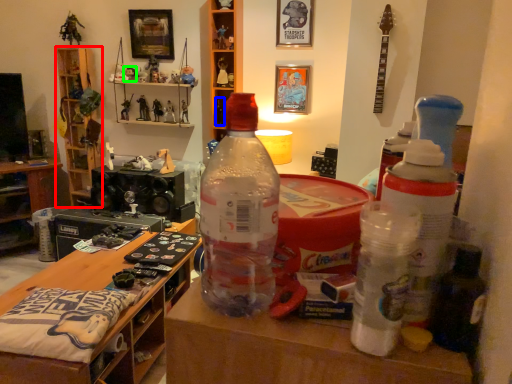
Question: Which object is the farthest from shelf (highlighted by a red box)? Choose among these: toy (highlighted by a blue box) or toy (highlighted by a green box).

Choices:
 (A) toy
 (B) toy

Answer: (A)